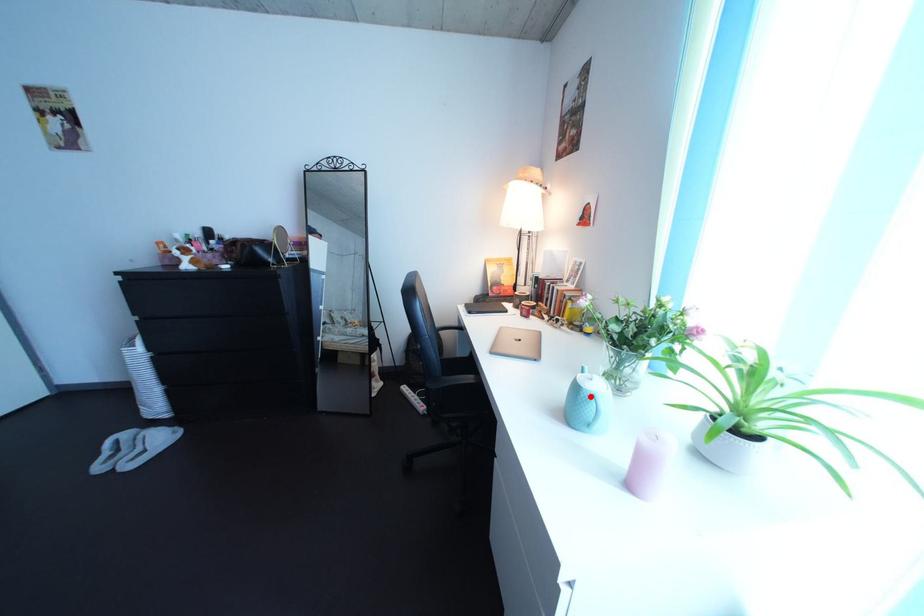
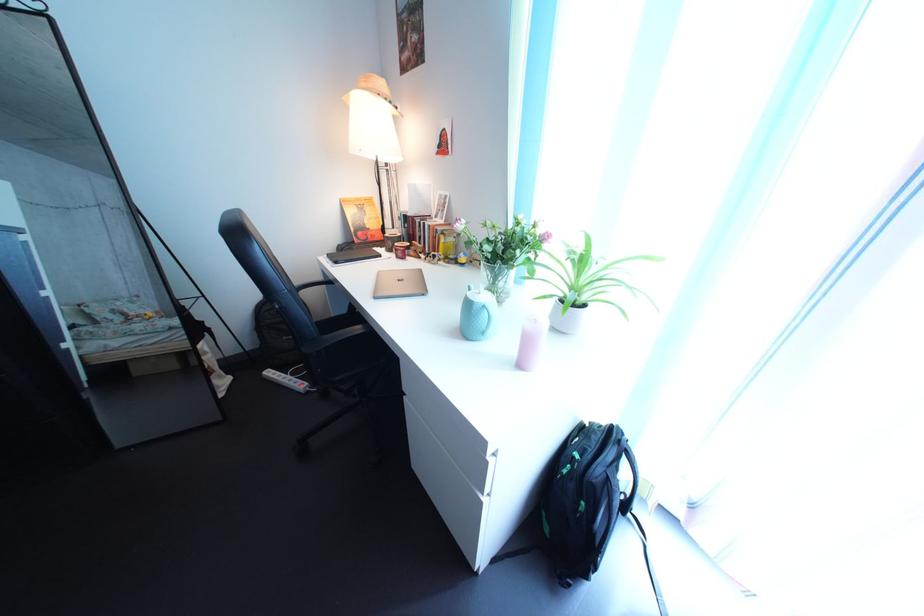
The point at the highlighted location is marked in the first image. Where is the corresponding point in the second image?

(482, 313)